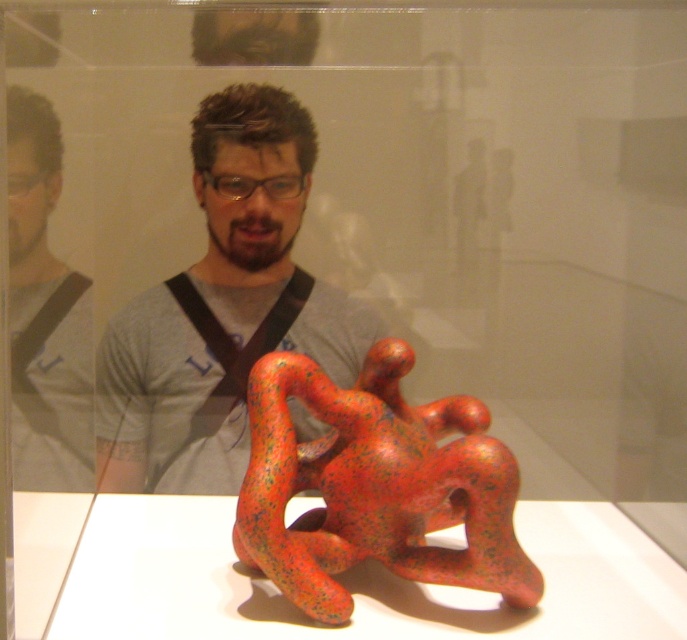
You are a visitor at an art exhibit and see the man in a matte gray shirt at center and the speckled red sculpture at center. Which object is taller?

The matte gray shirt at center is much taller than the speckled red sculpture at center.

You are a visitor at the exhibit and want to take a photo of the sculpture without the man blocking it. The sculpture is at the center of the display case. You notice the man is standing in a position where his matte gray shirt at center is represented by point (223, 308). If you move to the left side of the display case, will the sculpture be visible to you without the man blocking it?

The sculpture is at the center of the display case, and the man is standing such that his matte gray shirt at center is represented by point (223, 308). Moving to the left side of the display case would position you to the left of the man, allowing you to see the sculpture without obstruction from the man.